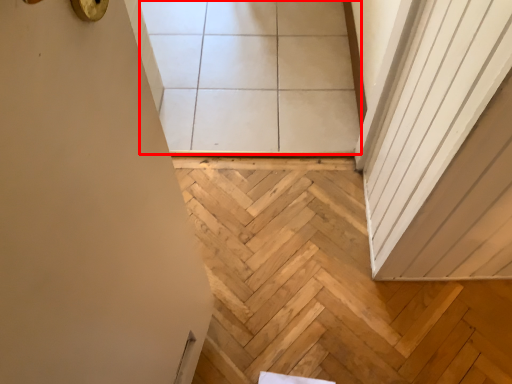
Question: From the image's perspective, what is the correct spatial positioning of tile (annotated by the red box) in reference to stairwell?

Choices:
 (A) above
 (B) below

Answer: (A)